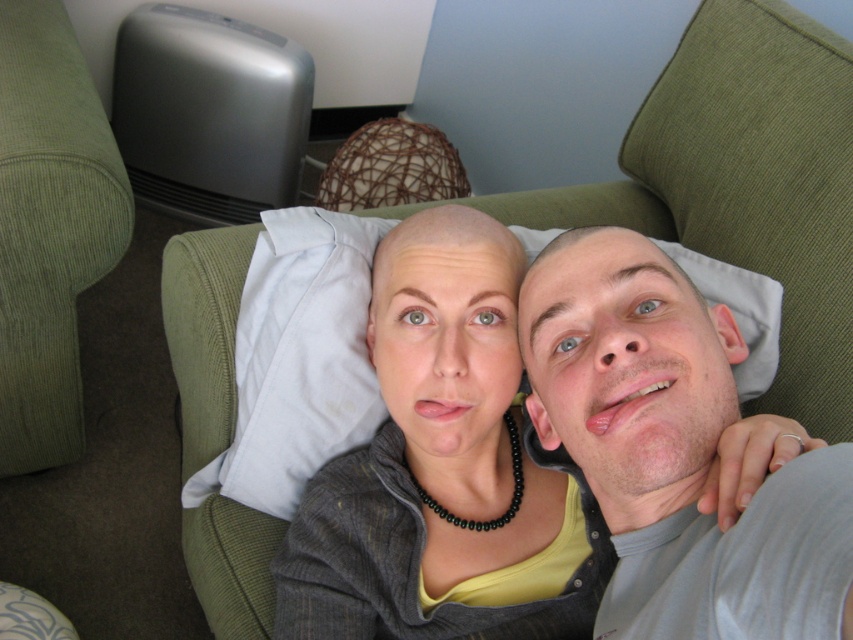
Consider the image. You are a photographer trying to capture a closeup shot of the gray fabric shirt at upper right and the white fabric pillow at center. Which object should you zoom in on first to ensure it fits entirely within the frame?

The gray fabric shirt at upper right is smaller than the white fabric pillow at center, so you should zoom in on the gray fabric shirt at upper right first to ensure it fits entirely within the frame before adjusting for the larger pillow.

You are trying to decide whether to place a new decorative item on the matte gray sweater at center or the white fabric pillow at center. Based on their sizes, which object would be more suitable for placing a small item?

The white fabric pillow at center is larger than the matte gray sweater at center, so placing a small item on the white fabric pillow at center would be more suitable.

You are a photographer trying to capture the exact center of the matte gray sweater at center in an image. Given that the image has a coordinate system where the bottom left corner is the origin, can you determine if the point at coordinates point (444, 468) is the correct location for the sweater?

Yes, the point (444, 468) marks the exact center of the matte gray sweater at center, so it is the correct location for the sweater.